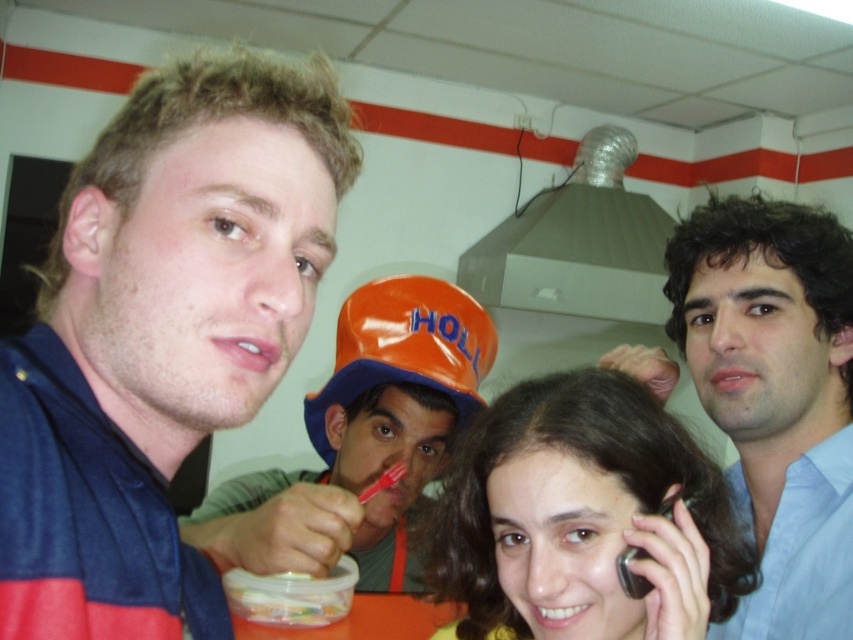
You are organizing a clothing donation drive and need to determine which items can fit into a small donation box. Given the two blue shirts in the image, the blue fabric shirt at center and the blue shirt at right, which one is more likely to fit into the box?

The blue fabric shirt at center occupies less space than the blue shirt at right, so it is more likely to fit into the small donation box.

You are a construction worker who needs to locate your tools. You see a matte black phone at center and a matte orange hard hat at center. Which object is positioned lower?

The matte black phone at center is located below the matte orange hard hat at center, so it is positioned lower.